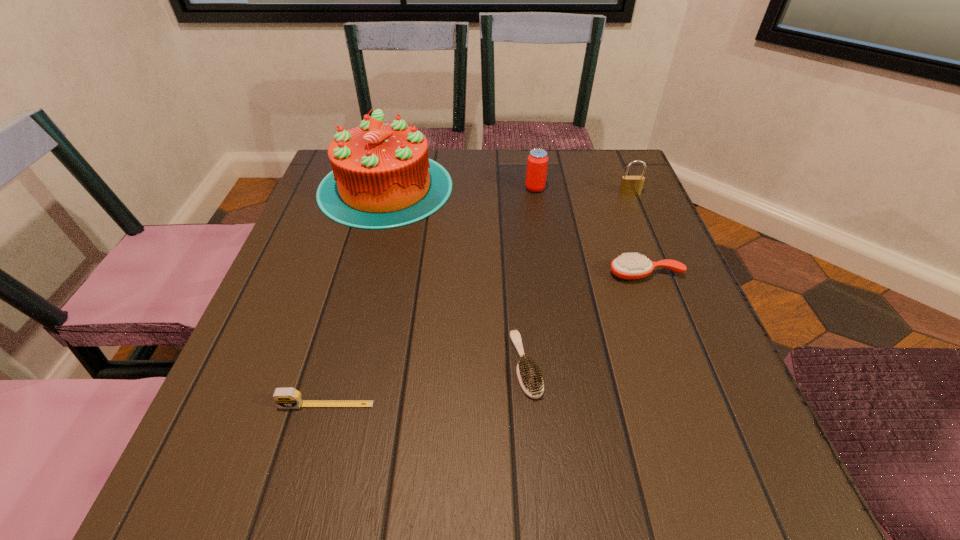
This screenshot has width=960, height=540. Identify the location of free area in between the cake and the third nearest object. (516, 231).

You are a GUI agent. You are given a task and a screenshot of the screen. Output one action in this format:
    pyautogui.click(x=<x>, y=<y>)
    Task: Click on the free space between the scrubbing brush and the tallest object
    This screenshot has width=960, height=540.
    Given the screenshot: What is the action you would take?
    pyautogui.click(x=456, y=276)

The height and width of the screenshot is (540, 960). Find the location of `vacant area that lies between the padlock and the cake`. vacant area that lies between the padlock and the cake is located at coordinates (508, 190).

I want to click on vacant area that lies between the beer can and the tallest object, so click(460, 188).

You are a GUI agent. You are given a task and a screenshot of the screen. Output one action in this format:
    pyautogui.click(x=<x>, y=<y>)
    Task: Click on the unoccupied position between the tape measure and the padlock
    This screenshot has height=540, width=960.
    Given the screenshot: What is the action you would take?
    (478, 299)

The width and height of the screenshot is (960, 540). Find the location of `free space between the fourth object from right to left and the tallest object`. free space between the fourth object from right to left and the tallest object is located at coordinates (456, 276).

Find the location of `free spot between the scrubbing brush and the tape measure`. free spot between the scrubbing brush and the tape measure is located at coordinates (426, 384).

Where is `empty space that is in between the shortest object and the cake`? This screenshot has width=960, height=540. empty space that is in between the shortest object and the cake is located at coordinates (456, 276).

Where is `object that stands as the closest to the tape measure`? object that stands as the closest to the tape measure is located at coordinates (529, 375).

Where is `object that stands as the closest to the scrubbing brush`? Image resolution: width=960 pixels, height=540 pixels. object that stands as the closest to the scrubbing brush is located at coordinates (630, 266).